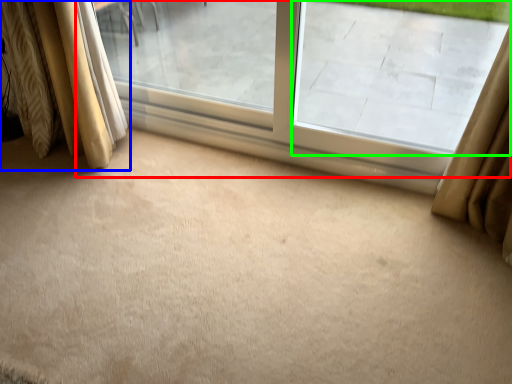
Question: Based on their relative distances, which object is farther from window (highlighted by a red box)? Choose from curtain (highlighted by a blue box) and window screen (highlighted by a green box).

Choices:
 (A) curtain
 (B) window screen

Answer: (A)